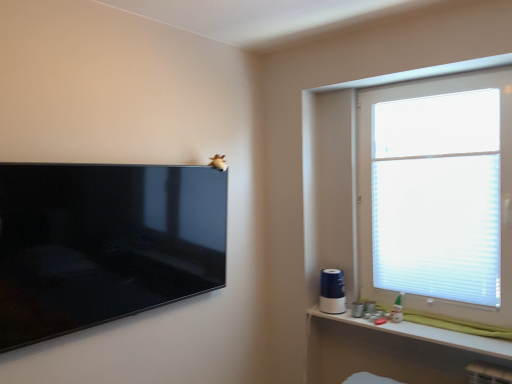
Question: Is white plastic shelf at lower right thinner than white translucent blinds at upper right?

Choices:
 (A) no
 (B) yes

Answer: (A)

Question: Can you confirm if white plastic shelf at lower right is smaller than white translucent blinds at upper right?

Choices:
 (A) no
 (B) yes

Answer: (B)

Question: From the image's perspective, would you say white plastic shelf at lower right is shown under white translucent blinds at upper right?

Choices:
 (A) no
 (B) yes

Answer: (B)

Question: Is white plastic shelf at lower right far away from white translucent blinds at upper right?

Choices:
 (A) yes
 (B) no

Answer: (B)

Question: From a real-world perspective, is white plastic shelf at lower right on white translucent blinds at upper right?

Choices:
 (A) yes
 (B) no

Answer: (B)

Question: Can you confirm if white plastic shelf at lower right is positioned to the left of white translucent blinds at upper right?

Choices:
 (A) yes
 (B) no

Answer: (A)

Question: Is matte black tv at upper left aimed at white translucent blinds at upper right?

Choices:
 (A) yes
 (B) no

Answer: (B)

Question: Is matte black tv at upper left located outside white translucent blinds at upper right?

Choices:
 (A) yes
 (B) no

Answer: (A)

Question: From a real-world perspective, is matte black tv at upper left under white translucent blinds at upper right?

Choices:
 (A) no
 (B) yes

Answer: (B)

Question: Considering the relative sizes of matte black tv at upper left and white translucent blinds at upper right in the image provided, is matte black tv at upper left thinner than white translucent blinds at upper right?

Choices:
 (A) no
 (B) yes

Answer: (A)

Question: Would you say white translucent blinds at upper right is part of matte black tv at upper left's contents?

Choices:
 (A) yes
 (B) no

Answer: (B)

Question: Can you confirm if matte black tv at upper left is taller than white translucent blinds at upper right?

Choices:
 (A) yes
 (B) no

Answer: (B)

Question: Is white translucent blinds at upper right aimed at matte black tv at upper left?

Choices:
 (A) yes
 (B) no

Answer: (B)